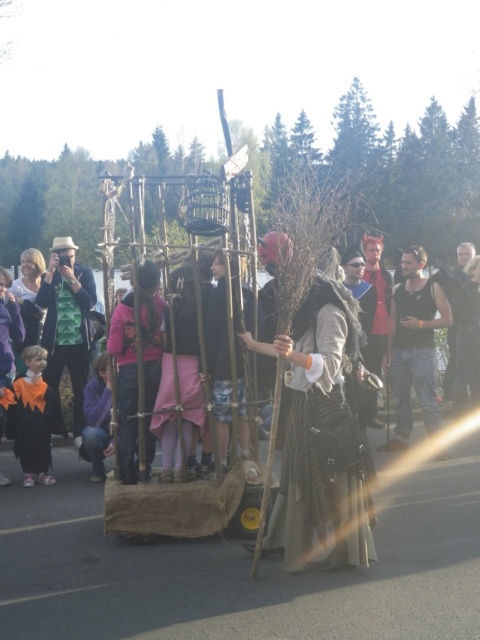
Question: Does orange felt costume at lower left have a larger size compared to purple fleece jacket at lower left?

Choices:
 (A) no
 (B) yes

Answer: (A)

Question: Considering the real-world distances, which object is farthest from the orange felt costume at lower left?

Choices:
 (A) dark brown leather vest at center
 (B) pink fabric dress at center
 (C) green textured shirt at left
 (D) pink fabric at center

Answer: (A)

Question: Which of the following is the closest to the observer?

Choices:
 (A) brown textured fabric dress at center
 (B) black sleeveless shirt at center

Answer: (A)

Question: Based on their relative distances, which object is farther from the brown textured fabric dress at center?

Choices:
 (A) pink fabric dress at center
 (B) orange felt costume at lower left
 (C) purple fleece jacket at lower left

Answer: (B)

Question: Can you confirm if orange felt costume at lower left is positioned to the right of shiny red hair at center?

Choices:
 (A) yes
 (B) no

Answer: (B)

Question: Does pink fabric dress at center appear on the right side of purple fleece jacket at lower left?

Choices:
 (A) no
 (B) yes

Answer: (B)